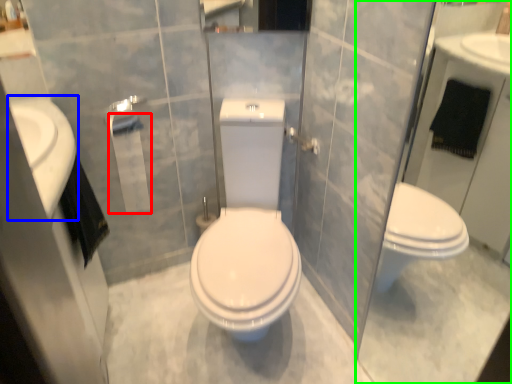
Question: Based on their relative distances, which object is nearer to toilet paper (highlighted by a red box)? Choose from sink (highlighted by a blue box) and glass door (highlighted by a green box).

Choices:
 (A) sink
 (B) glass door

Answer: (A)